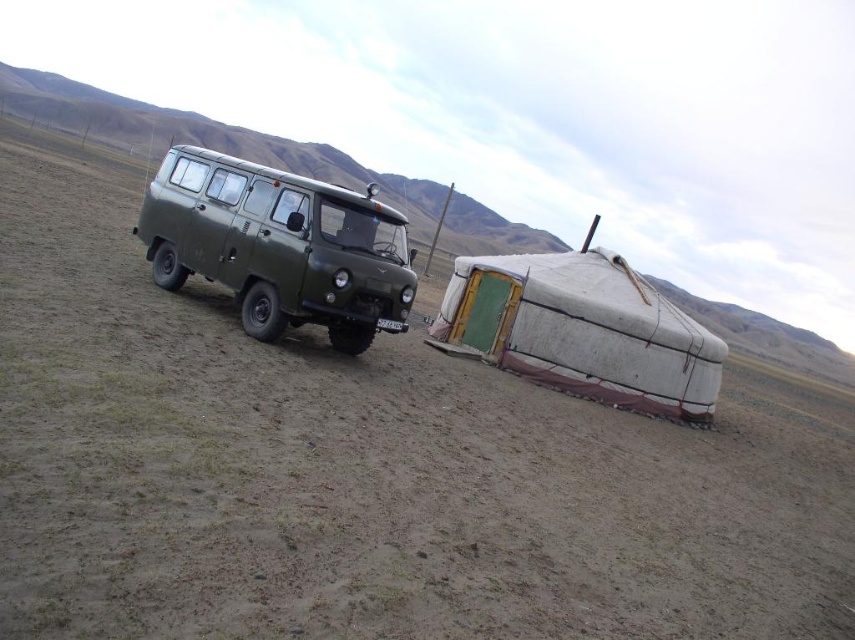
Between olive green matte van at center and white canvas tent at lower right, which one is positioned lower?

white canvas tent at lower right is lower down.

Can you confirm if olive green matte van at center is smaller than white canvas tent at lower right?

Incorrect, olive green matte van at center is not smaller in size than white canvas tent at lower right.

The width and height of the screenshot is (855, 640). In order to click on olive green matte van at center in this screenshot , I will do `click(279, 244)`.

The width and height of the screenshot is (855, 640). Find the location of `olive green matte van at center`. olive green matte van at center is located at coordinates (279, 244).